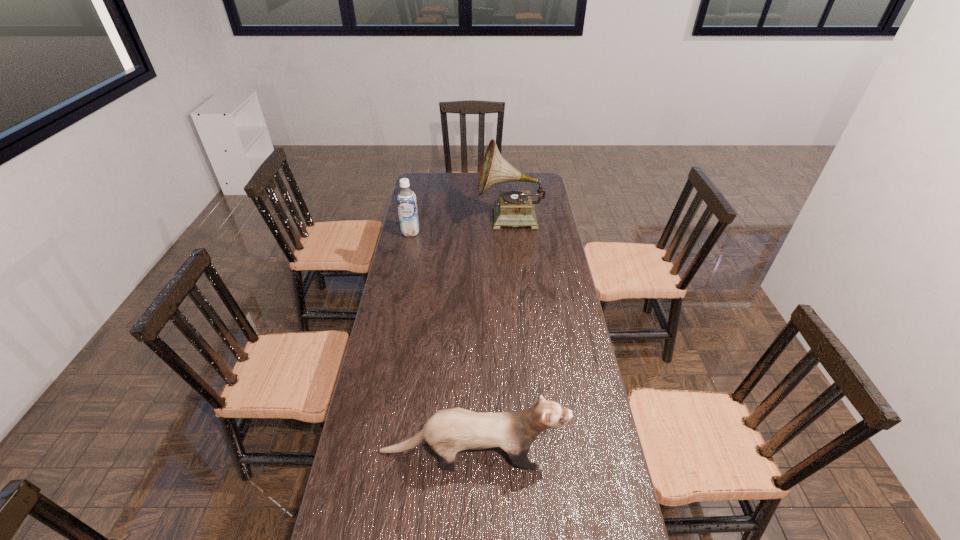
Select which object appears as the second closest to the second shortest object. Please provide its 2D coordinates. Your answer should be formatted as a tuple, i.e. [(x, y)], where the tuple contains the x and y coordinates of a point satisfying the conditions above.

[(449, 431)]

At what (x,y) coordinates should I click in order to perform the action: click on blank area in the image that satisfies the following two spatial constraints: 1. from the horn of the tallest object; 2. on the label of the soya milk. Please return your answer as a coordinate pair (x, y). Image resolution: width=960 pixels, height=540 pixels. Looking at the image, I should click on (511, 232).